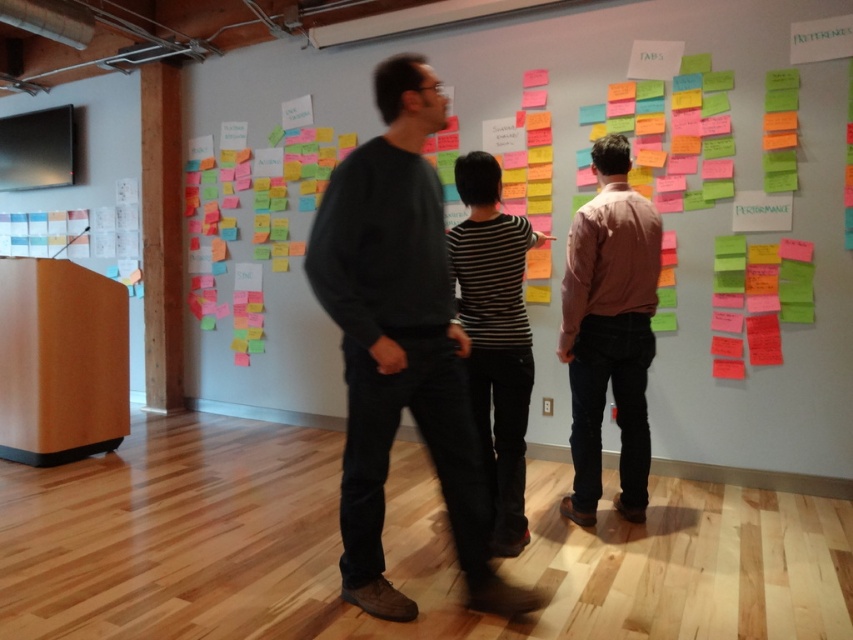
Is dark gray sweater at center taller than pink cotton shirt at center?

Yes.

Who is more forward, (451, 499) or (590, 273)?

Point (451, 499) is more forward.

Locate an element on the screen. dark gray sweater at center is located at coordinates coord(401,342).

Is point (761, 90) farther from viewer compared to point (444, 260)?

Yes, it is behind point (444, 260).

Who is taller, multicolored sticky notes at center or dark gray sweater at center?

dark gray sweater at center is taller.

Find the location of `multicolored sticky notes at center`. multicolored sticky notes at center is located at coordinates (517, 102).

Who is taller, multicolored sticky notes at center or pink cotton shirt at center?

Standing taller between the two is pink cotton shirt at center.

Does point (741, 458) come farther from viewer compared to point (642, 330)?

Yes, it is behind point (642, 330).

Locate an element on the screen. The image size is (853, 640). multicolored sticky notes at center is located at coordinates (517, 102).